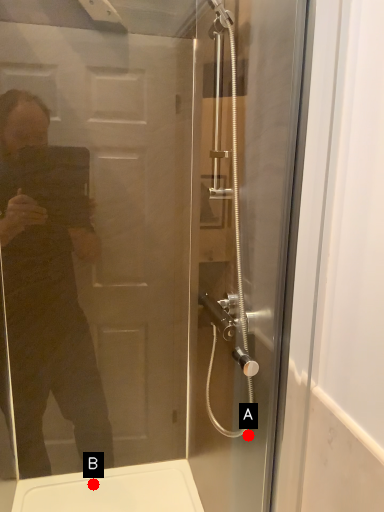
Question: Two points are circled on the image, labeled by A and B beside each circle. Which point is closer to the camera?

Choices:
 (A) A is closer
 (B) B is closer

Answer: (A)